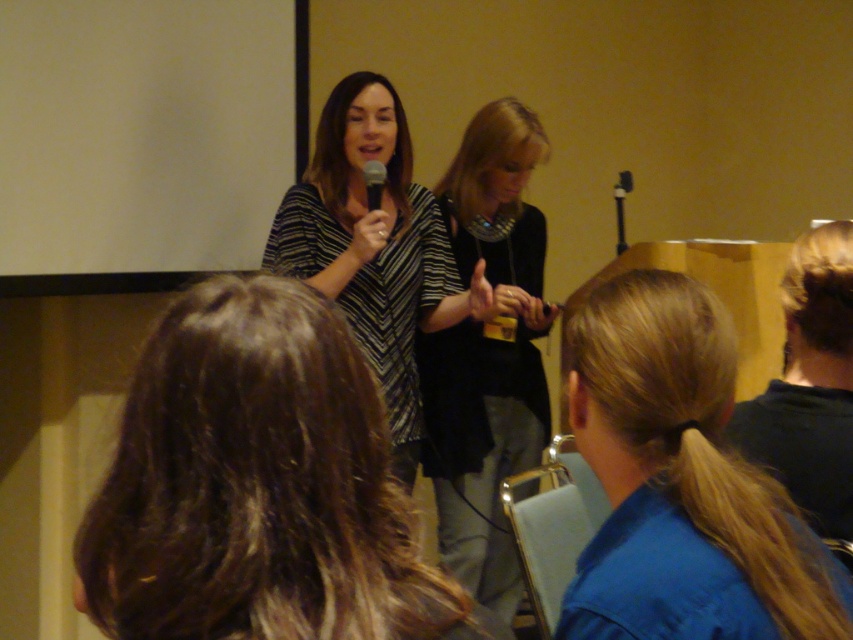
Who is taller, blonde hair at lower right or black fabric dress at center?

black fabric dress at center is taller.

Can you confirm if blonde hair at lower right is positioned above black fabric dress at center?

No.

Does point (635, 385) come behind point (503, 461)?

No.

Locate an element on the screen. Image resolution: width=853 pixels, height=640 pixels. blonde hair at lower right is located at coordinates (682, 483).

Is point (599, 611) positioned behind point (375, 104)?

No.

Can you confirm if blonde hair at lower right is smaller than striped fabric dress at center?

Yes.

You are a GUI agent. You are given a task and a screenshot of the screen. Output one action in this format:
    pyautogui.click(x=<x>, y=<y>)
    Task: Click on the blonde hair at lower right
    Image resolution: width=853 pixels, height=640 pixels.
    Given the screenshot: What is the action you would take?
    pyautogui.click(x=682, y=483)

Identify the location of blonde hair at lower right. The width and height of the screenshot is (853, 640). (682, 483).

Consider the image. Does brown wavy hair at center have a greater width compared to striped fabric dress at center?

In fact, brown wavy hair at center might be narrower than striped fabric dress at center.

Between brown wavy hair at center and striped fabric dress at center, which one is positioned lower?

brown wavy hair at center

Where is `brown wavy hair at center`? Image resolution: width=853 pixels, height=640 pixels. brown wavy hair at center is located at coordinates (258, 486).